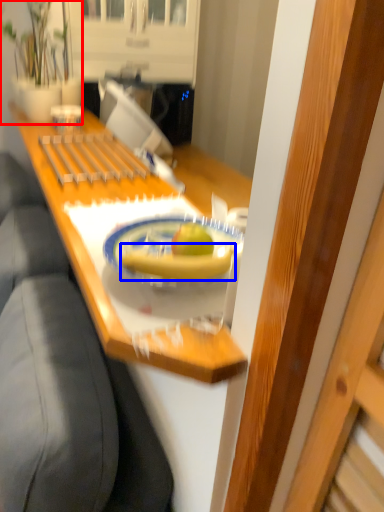
Question: Which of the following is the farthest to the observer, houseplant (highlighted by a red box) or banana (highlighted by a blue box)?

Choices:
 (A) houseplant
 (B) banana

Answer: (A)